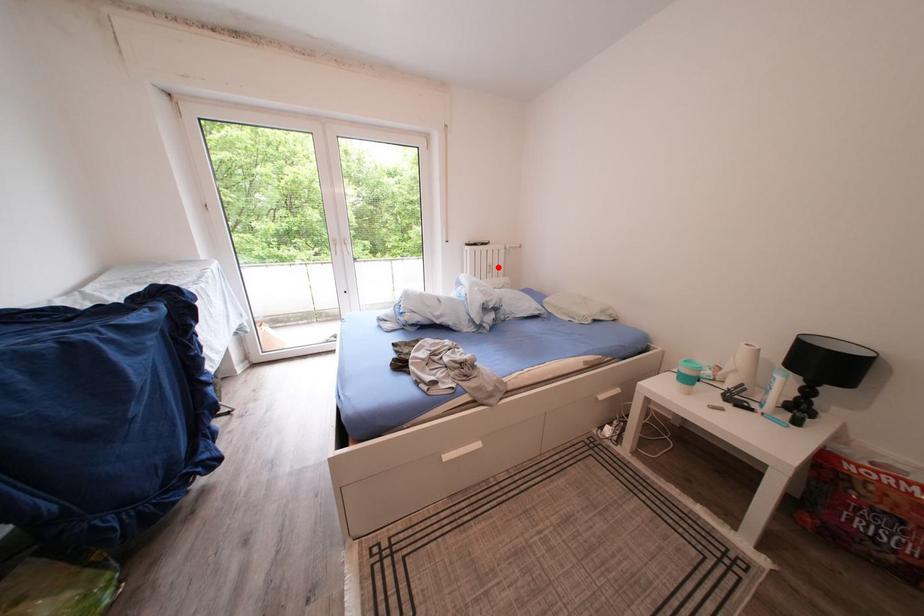
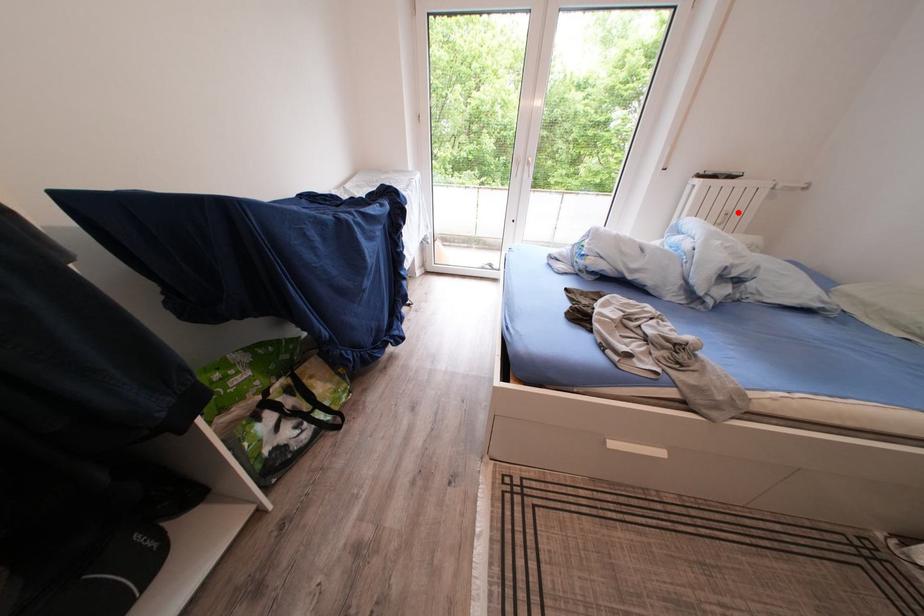
I am providing you with two images of the same scene from different viewpoints. A red point is marked on the first image and another point is marked on the second image. Do the highlighted points in image1 and image2 indicate the same real-world spot?

Yes